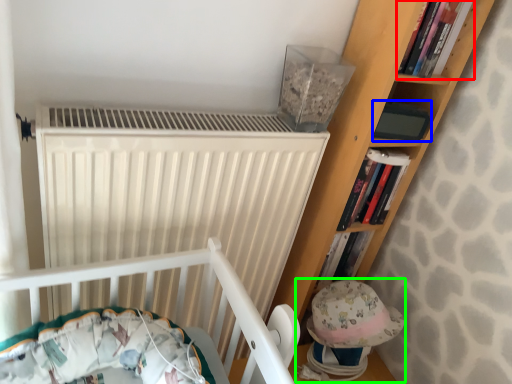
Question: Considering the real-world distances, which object is closest to book (highlighted by a red box)? paperback book (highlighted by a blue box) or toy (highlighted by a green box).

Choices:
 (A) paperback book
 (B) toy

Answer: (A)